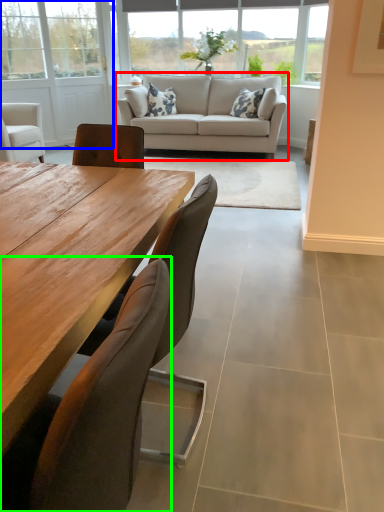
Question: Based on their relative distances, which object is nearer to studio couch (highlighted by a red box)? Choose from screen door (highlighted by a blue box) and chair (highlighted by a green box).

Choices:
 (A) screen door
 (B) chair

Answer: (A)